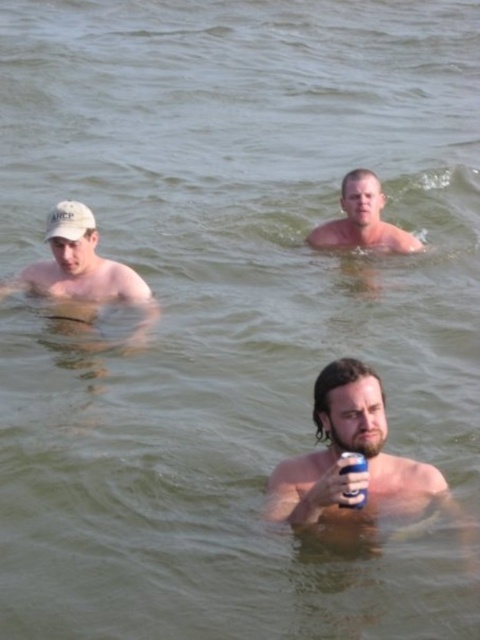
Does smooth skin man at center lie behind blue metallic can at lower center?

Yes, smooth skin man at center is further from the viewer.

Between point (375, 193) and point (345, 454), which one is positioned in front?

Positioned in front is point (345, 454).

The image size is (480, 640). I want to click on smooth skin man at center, so click(x=362, y=220).

Does bearded man at center appear on the left side of smooth skin man at center?

Indeed, bearded man at center is positioned on the left side of smooth skin man at center.

Who is lower down, bearded man at center or smooth skin man at center?

bearded man at center is lower down.

In order to click on bearded man at center in this screenshot , I will do `click(348, 461)`.

Locate an element on the screen. Image resolution: width=480 pixels, height=640 pixels. white matte cap at left is located at coordinates (84, 273).